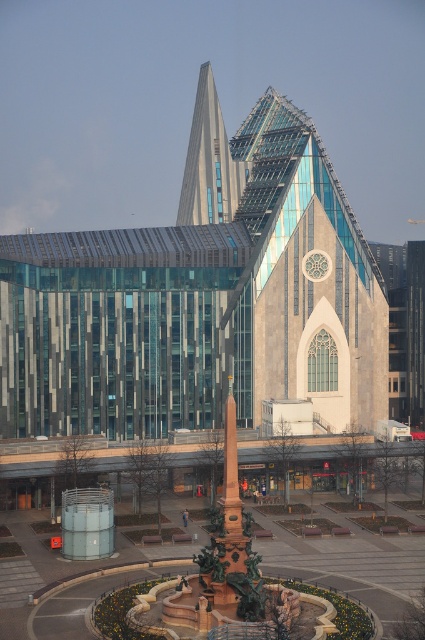
Based on the photo, you are standing in the plaza and want to reach the point marked at coordinates (108,429). Given that the plaza is 500 feet long, can you estimate whether you are closer to the fountain or the point?

The point marked at coordinates (108,429) is 460.70 feet away from you. Since the plaza is 500 feet long, the distance to the fountain would be less than 460.70 feet if the fountain is centrally located. Therefore, you are closer to the fountain than the marked point.

You are an architect reviewing the urban plaza design. You notice the transparent glass tower at center and the polished bronze obelisk at center. Which object is positioned higher in the scene?

The transparent glass tower at center is located above the polished bronze obelisk at center, so it is positioned higher in the scene.